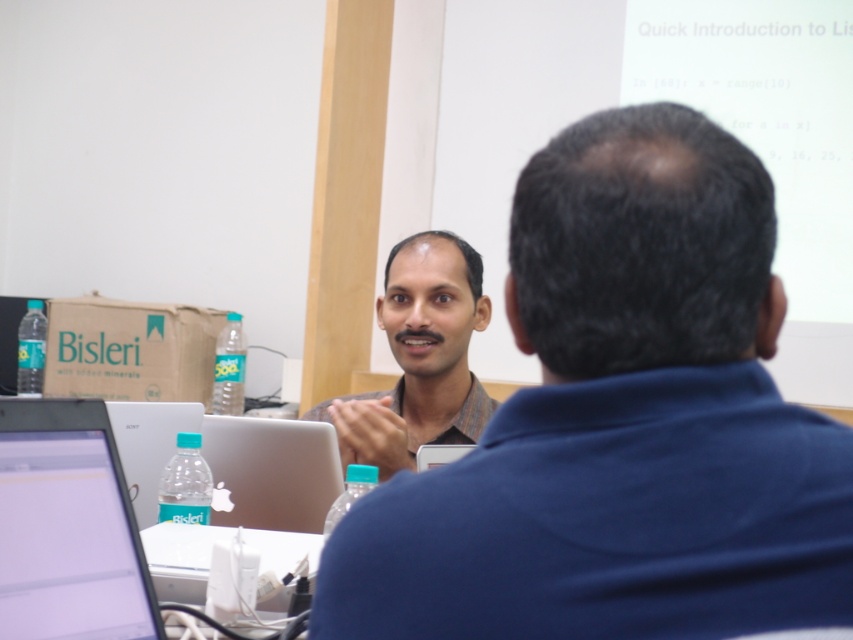
Question: Which object is the closest to the silver metallic laptop at lower left?

Choices:
 (A) matte black shirt at center
 (B) matte brown shirt at center

Answer: (A)

Question: Is matte black shirt at center positioned behind satin silver laptop at center?

Choices:
 (A) yes
 (B) no

Answer: (B)

Question: Is the position of silver metallic laptop at lower left less distant than that of satin silver laptop at center?

Choices:
 (A) yes
 (B) no

Answer: (A)

Question: Which point appears farthest from the camera in this image?

Choices:
 (A) (396, 317)
 (B) (13, 621)

Answer: (A)

Question: Among these points, which one is nearest to the camera?

Choices:
 (A) (430, 461)
 (B) (618, 204)
 (C) (7, 472)

Answer: (B)

Question: Is silver metallic laptop at lower left positioned before satin silver laptop at center?

Choices:
 (A) yes
 (B) no

Answer: (A)